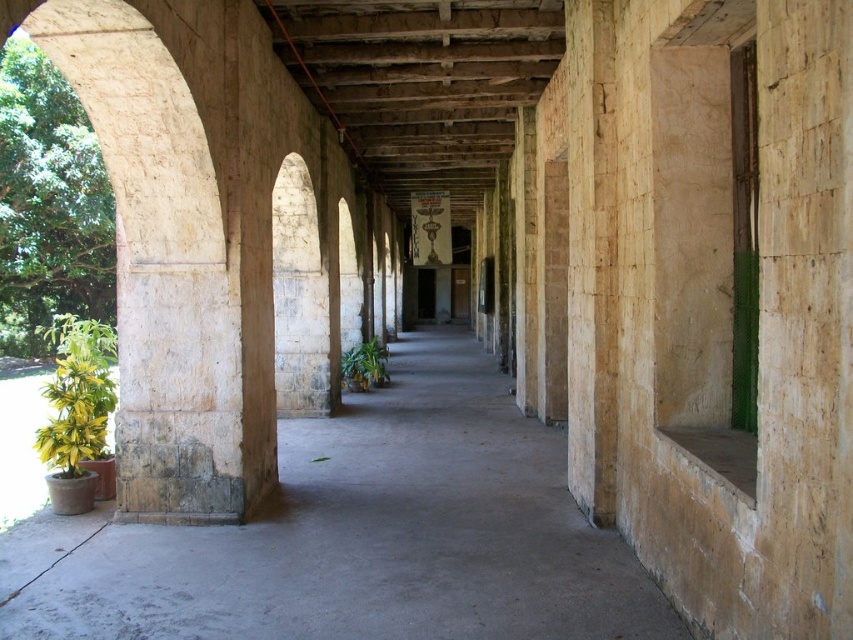
Question: Estimate the real-world distances between objects in this image. Which object is farther from the smooth concrete floor at center?

Choices:
 (A) green matte plant at center
 (B) green leafy plant at left

Answer: (B)

Question: Which of the following is the farthest from the observer?

Choices:
 (A) green matte plant at center
 (B) smooth concrete floor at center
 (C) green leafy plant at left

Answer: (A)

Question: Is smooth concrete floor at center below green matte plant at center?

Choices:
 (A) no
 (B) yes

Answer: (B)

Question: Can you confirm if green leafy plant at left is positioned above green matte plant at center?

Choices:
 (A) no
 (B) yes

Answer: (B)

Question: Which point is closer to the camera?

Choices:
 (A) (489, 435)
 (B) (369, 352)

Answer: (A)

Question: Can you confirm if smooth concrete floor at center is positioned to the left of green leafy plant at left?

Choices:
 (A) yes
 (B) no

Answer: (B)